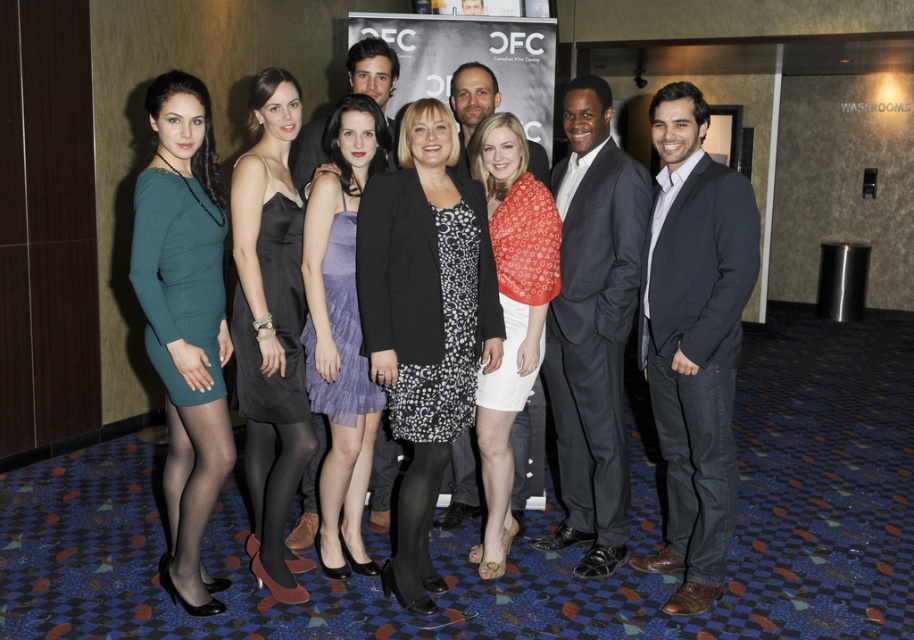
Question: Based on their relative distances, which object is farther from the white satin dress at center?

Choices:
 (A) black textured blazer at center
 (B) dark gray pinstripe suit at center

Answer: (B)

Question: Can you confirm if black textured blazer at center is positioned to the right of dark gray pinstripe suit at center?

Choices:
 (A) yes
 (B) no

Answer: (B)

Question: Among these objects, which one is nearest to the camera?

Choices:
 (A) dark gray pinstripe suit at center
 (B) lavender pleated dress at center
 (C) dark gray suit at center

Answer: (C)

Question: Is teal matte dress at left behind lavender pleated dress at center?

Choices:
 (A) yes
 (B) no

Answer: (B)

Question: Can you confirm if black textured blazer at center is positioned to the left of satin black dress at center?

Choices:
 (A) no
 (B) yes

Answer: (A)

Question: Which point is closer to the camera?

Choices:
 (A) dark gray pinstripe suit at center
 (B) satin black dress at center
 (C) lavender pleated dress at center
 (D) teal matte dress at left

Answer: (D)